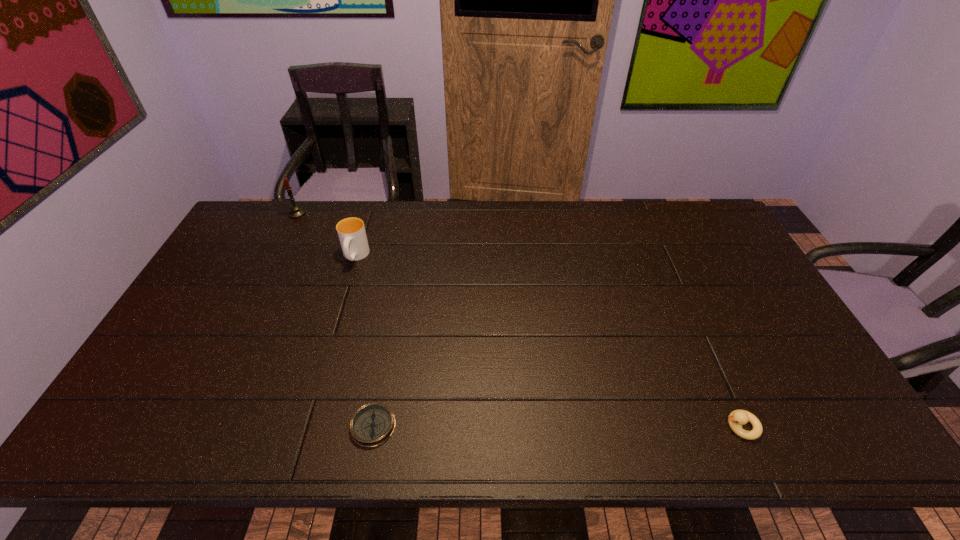
Locate an element on the screen. the farthest object is located at coordinates (295, 211).

Where is `the tallest object`? This screenshot has width=960, height=540. the tallest object is located at coordinates (295, 211).

Image resolution: width=960 pixels, height=540 pixels. Identify the location of the second object from left to right. (351, 231).

Find the location of a particular element. the third shortest object is located at coordinates (351, 231).

Find the location of a particular element. duckling is located at coordinates (737, 418).

The width and height of the screenshot is (960, 540). In order to click on the rightmost object in this screenshot , I will do `click(737, 418)`.

Where is `the second object from right to left`? The width and height of the screenshot is (960, 540). the second object from right to left is located at coordinates (372, 424).

Where is `the shortest object`? This screenshot has height=540, width=960. the shortest object is located at coordinates (372, 424).

Where is `vacant space positioned on the front of the farthest object`? vacant space positioned on the front of the farthest object is located at coordinates (264, 279).

You are a GUI agent. You are given a task and a screenshot of the screen. Output one action in this format:
    pyautogui.click(x=<x>, y=<y>)
    Task: Click on the vacant region located 0.060m with the handle on the side of the third object from right to left
    Image resolution: width=960 pixels, height=540 pixels.
    Given the screenshot: What is the action you would take?
    pyautogui.click(x=347, y=284)